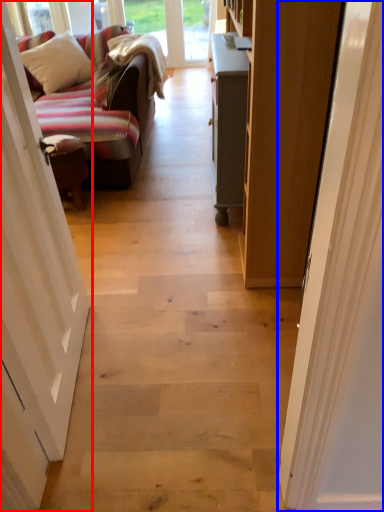
Question: Which of the following is the closest to the observer, door (highlighted by a red box) or door (highlighted by a blue box)?

Choices:
 (A) door
 (B) door

Answer: (A)